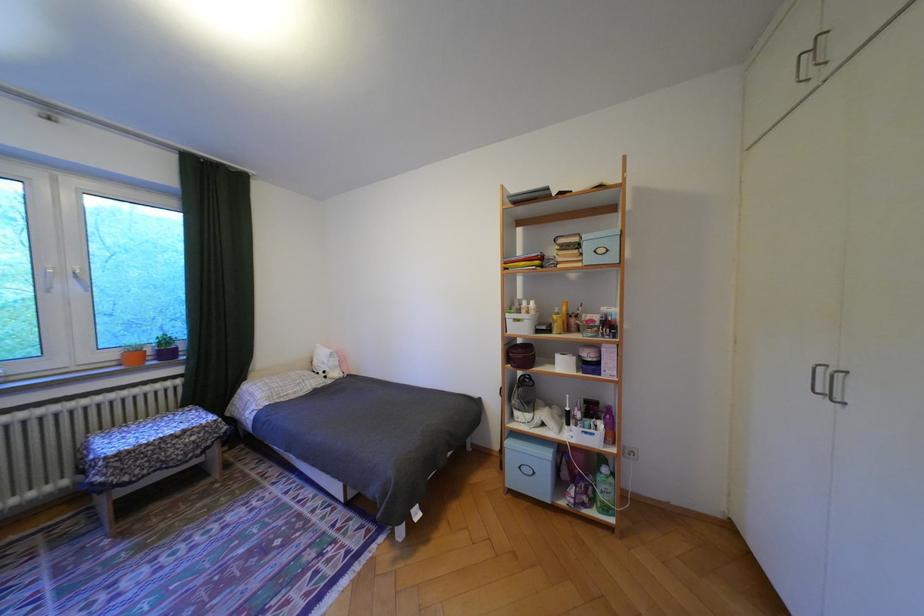
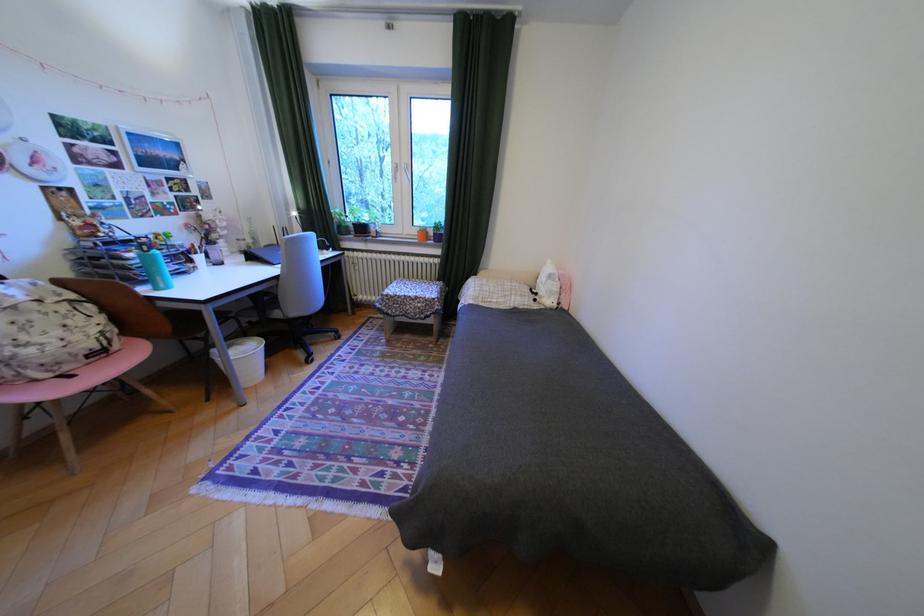
The point at (x=335, y=371) is marked in the first image. Where is the corresponding point in the second image?

(548, 294)